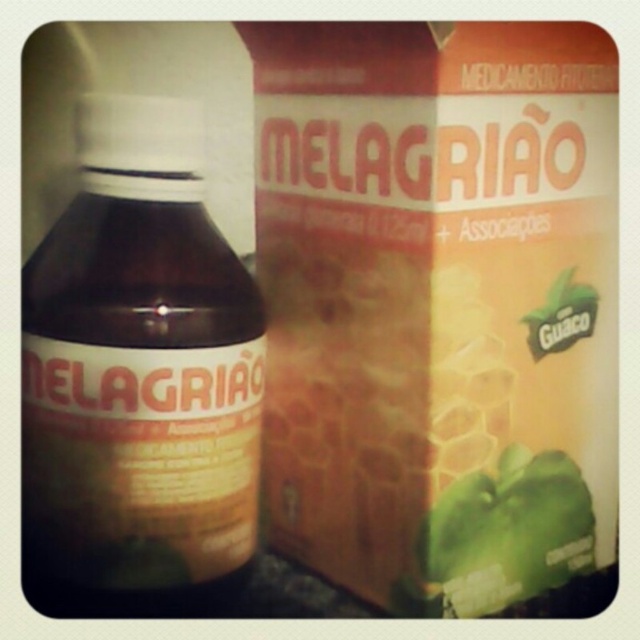
Find the location of a particular element. matte brown box at center is located at coordinates (440, 308).

Does matte brown box at center have a lesser width compared to green matte pepper at center?

Incorrect, matte brown box at center's width is not less than green matte pepper at center's.

Does point (534, 460) lie behind point (451, 563)?

Yes, it is.

The image size is (640, 640). Find the location of `matte brown box at center`. matte brown box at center is located at coordinates (440, 308).

Is matte brown box at center to the right of brown glass bottle at left from the viewer's perspective?

Indeed, matte brown box at center is positioned on the right side of brown glass bottle at left.

Is matte brown box at center smaller than brown glass bottle at left?

No, matte brown box at center is not smaller than brown glass bottle at left.

At what (x,y) coordinates should I click in order to perform the action: click on matte brown box at center. Please return your answer as a coordinate pair (x, y). Looking at the image, I should click on (440, 308).

Where is `matte brown box at center`? The height and width of the screenshot is (640, 640). matte brown box at center is located at coordinates (440, 308).

Does point (140, 387) lie in front of point (470, 596)?

Yes, point (140, 387) is in front of point (470, 596).

Which is more to the right, brown glass bottle at left or green matte pepper at center?

Positioned to the right is green matte pepper at center.

Which is behind, point (120, 596) or point (452, 602)?

Positioned behind is point (452, 602).

Where is `brown glass bottle at left`? The height and width of the screenshot is (640, 640). brown glass bottle at left is located at coordinates (138, 378).